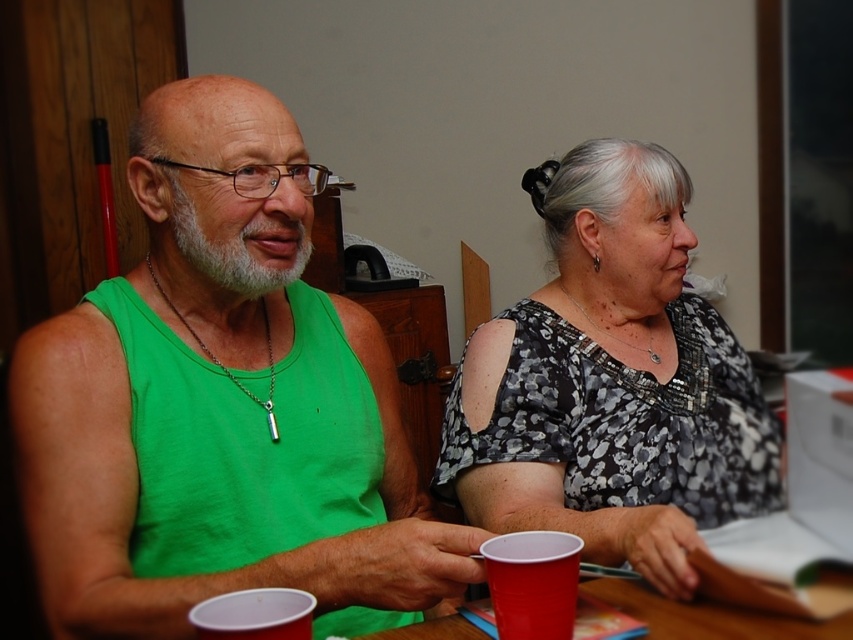
Measure the distance between point (424, 621) and camera.

The distance of point (424, 621) from camera is 34.58 inches.

Is smooth wooden table at center to the right of matte plastic cup at lower left from the viewer's perspective?

Yes, smooth wooden table at center is to the right of matte plastic cup at lower left.

Measure the distance between point (788, 616) and camera.

They are 82.49 centimeters apart.

Where is `smooth wooden table at center`? Image resolution: width=853 pixels, height=640 pixels. smooth wooden table at center is located at coordinates (706, 616).

In the scene shown: Between matte plastic cup at lower center and matte plastic cup at lower left, which one appears on the left side from the viewer's perspective?

matte plastic cup at lower left

What do you see at coordinates (532, 582) in the screenshot?
I see `matte plastic cup at lower center` at bounding box center [532, 582].

The width and height of the screenshot is (853, 640). I want to click on matte plastic cup at lower center, so click(x=532, y=582).

Does floral-patterned blouse at center have a smaller size compared to matte plastic cup at lower left?

Incorrect, floral-patterned blouse at center is not smaller in size than matte plastic cup at lower left.

Between floral-patterned blouse at center and matte plastic cup at lower left, which one appears on the right side from the viewer's perspective?

floral-patterned blouse at center is more to the right.

Which is in front, point (556, 502) or point (289, 625)?

Point (289, 625)

The height and width of the screenshot is (640, 853). Find the location of `floral-patterned blouse at center`. floral-patterned blouse at center is located at coordinates point(610,381).